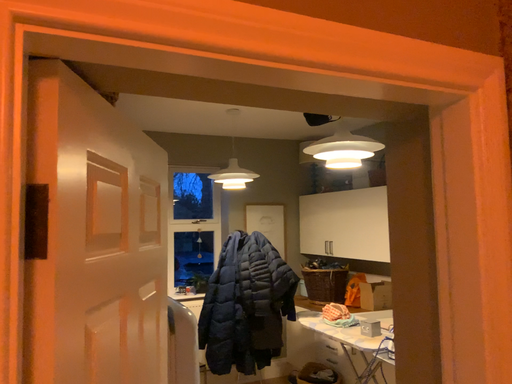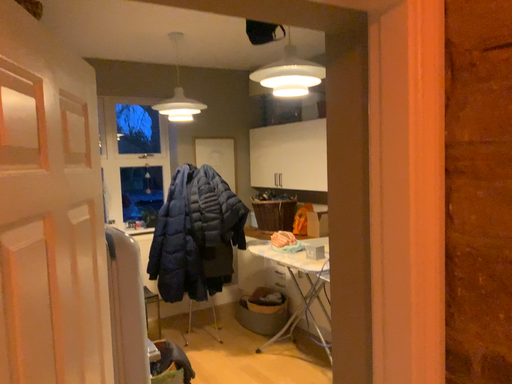
Question: How did the camera likely rotate when shooting the video?

Choices:
 (A) rotated upward
 (B) rotated downward

Answer: (B)